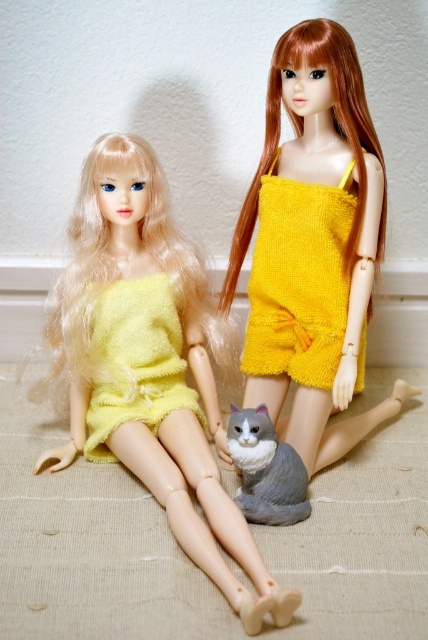
You are a child trying to decide which toy to pick up first. You see the yellow fuzzy dress at center and the gray plush cat at lower center. Which one is wider?

The yellow fuzzy dress at center is wider than the gray plush cat at lower center.

You are a toy organizer trying to arrange these two dolls on a shelf. The shelf has a height limit of 12 inches. If the matte yellow fabric dress at left is 14 inches tall and the yellow fuzzy dress at center is 10 inches tall, will both dolls fit on the shelf without exceeding the height limit?

The matte yellow fabric dress at left is 14 inches tall, which exceeds the 12 inch height limit, so it cannot fit on the shelf. The yellow fuzzy dress at center is 10 inches tall and will fit. Therefore, only the yellow fuzzy dress at center can be placed on the shelf.

You are a toy organizer arranging dolls on a shelf. You need to place the matte yellow fabric dress at left and the yellow knitted romper at center in a row from left to right. Based on their positions in the image, which order should you arrange them?

The matte yellow fabric dress at left is to the left of the yellow knitted romper at center, so you should arrange them in the order matte yellow fabric dress at left first, followed by yellow knitted romper at center.